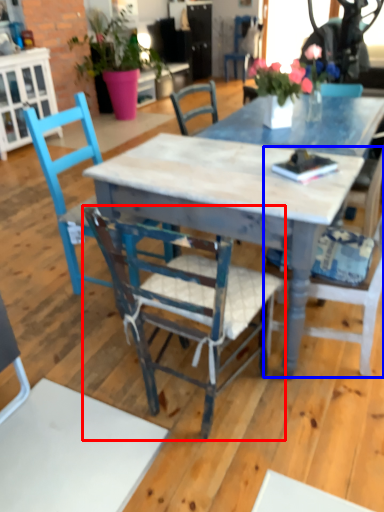
Question: Among these objects, which one is farthest to the camera, chair (highlighted by a red box) or chair (highlighted by a blue box)?

Choices:
 (A) chair
 (B) chair

Answer: (B)